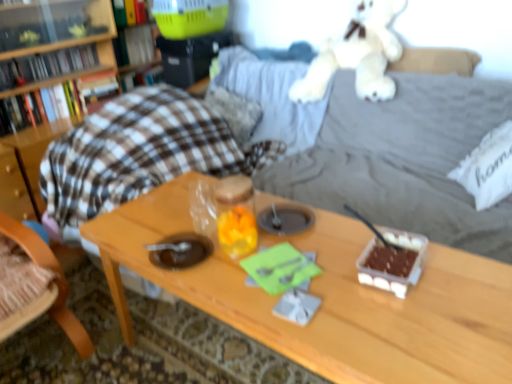
The height and width of the screenshot is (384, 512). What are the coordinates of `space that is in front of translucent plastic container with chocolate at right` in the screenshot? It's located at (421, 312).